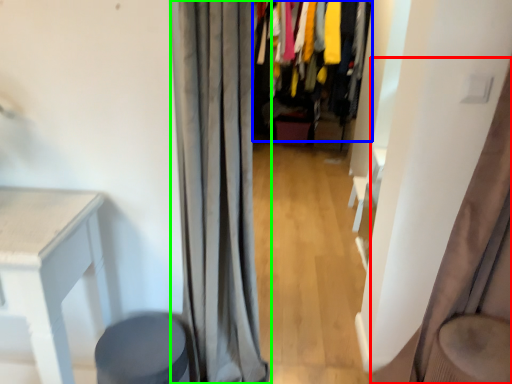
Question: Estimate the real-world distances between objects in this image. Which object is closer to curtain (highlighted by a red box), closet (highlighted by a blue box) or curtain (highlighted by a green box)?

Choices:
 (A) closet
 (B) curtain

Answer: (B)